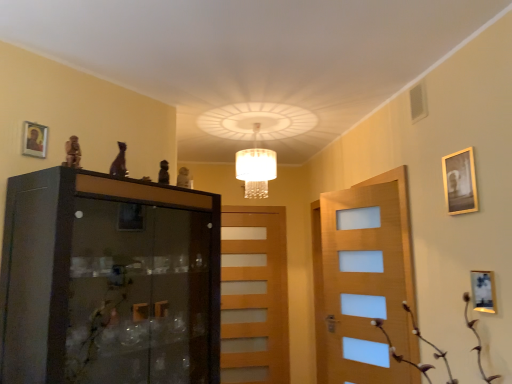
Question: From the image's perspective, does white crystal chandelier at center appear higher than brown textured plant at lower right?

Choices:
 (A) yes
 (B) no

Answer: (A)

Question: From a real-world perspective, does white crystal chandelier at center stand above brown textured plant at lower right?

Choices:
 (A) yes
 (B) no

Answer: (A)

Question: Considering the relative sizes of white crystal chandelier at center and brown textured plant at lower right in the image provided, is white crystal chandelier at center shorter than brown textured plant at lower right?

Choices:
 (A) yes
 (B) no

Answer: (B)

Question: Can you confirm if white crystal chandelier at center is wider than brown textured plant at lower right?

Choices:
 (A) yes
 (B) no

Answer: (B)

Question: Considering the relative positions of white crystal chandelier at center and brown textured plant at lower right in the image provided, is white crystal chandelier at center to the right of brown textured plant at lower right from the viewer's perspective?

Choices:
 (A) no
 (B) yes

Answer: (A)

Question: Is black glass cabinet at left to the left or to the right of wooden picture frame at right, the 3th picture frame positioned from the left, in the image?

Choices:
 (A) right
 (B) left

Answer: (B)

Question: In terms of height, does black glass cabinet at left look taller or shorter compared to wooden picture frame at right, the 3th picture frame positioned from the left?

Choices:
 (A) short
 (B) tall

Answer: (B)

Question: In the image, is black glass cabinet at left positioned in front of or behind wooden picture frame at right, the 3th picture frame positioned from the left?

Choices:
 (A) front
 (B) behind

Answer: (A)

Question: From a real-world perspective, is black glass cabinet at left positioned above or below wooden picture frame at right, the 3th picture frame positioned from the left?

Choices:
 (A) below
 (B) above

Answer: (A)

Question: From the image's perspective, relative to light brown wooden door at center, is white crystal chandelier at center above or below?

Choices:
 (A) above
 (B) below

Answer: (A)

Question: In terms of height, does white crystal chandelier at center look taller or shorter compared to light brown wooden door at center?

Choices:
 (A) short
 (B) tall

Answer: (A)

Question: Considering the positions of white crystal chandelier at center and light brown wooden door at center in the image, is white crystal chandelier at center wider or thinner than light brown wooden door at center?

Choices:
 (A) wide
 (B) thin

Answer: (A)

Question: Relative to light brown wooden door at center, is white crystal chandelier at center in front or behind?

Choices:
 (A) front
 (B) behind

Answer: (A)

Question: Considering the positions of gold-framed picture at upper left, placed as the 1th picture frame when sorted from top to bottom, and wooden picture frame at right, which is the third picture frame from top to bottom, in the image, is gold-framed picture at upper left, placed as the 1th picture frame when sorted from top to bottom, taller or shorter than wooden picture frame at right, which is the third picture frame from top to bottom,?

Choices:
 (A) tall
 (B) short

Answer: (B)

Question: Do you think gold-framed picture at upper left, which ranks as the 3th picture frame in right-to-left order, is within wooden picture frame at right, the first picture frame when ordered from right to left, or outside of it?

Choices:
 (A) inside
 (B) outside

Answer: (B)